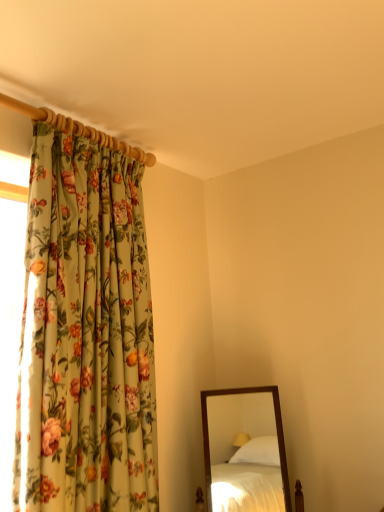
Question: From a real-world perspective, is floral fabric curtain at left physically located above or below wooden-framed mirror at lower right?

Choices:
 (A) above
 (B) below

Answer: (A)

Question: From the image's perspective, relative to wooden-framed mirror at lower right, is floral fabric curtain at left above or below?

Choices:
 (A) below
 (B) above

Answer: (B)

Question: Does point (117, 204) appear closer or farther from the camera than point (249, 502)?

Choices:
 (A) farther
 (B) closer

Answer: (B)

Question: In terms of width, does wooden-framed mirror at lower right look wider or thinner when compared to floral fabric curtain at left?

Choices:
 (A) thin
 (B) wide

Answer: (B)

Question: Looking at the image, does wooden-framed mirror at lower right seem bigger or smaller compared to floral fabric curtain at left?

Choices:
 (A) big
 (B) small

Answer: (B)

Question: Is wooden-framed mirror at lower right taller or shorter than floral fabric curtain at left?

Choices:
 (A) tall
 (B) short

Answer: (B)

Question: Relative to floral fabric curtain at left, is wooden-framed mirror at lower right in front or behind?

Choices:
 (A) behind
 (B) front

Answer: (A)